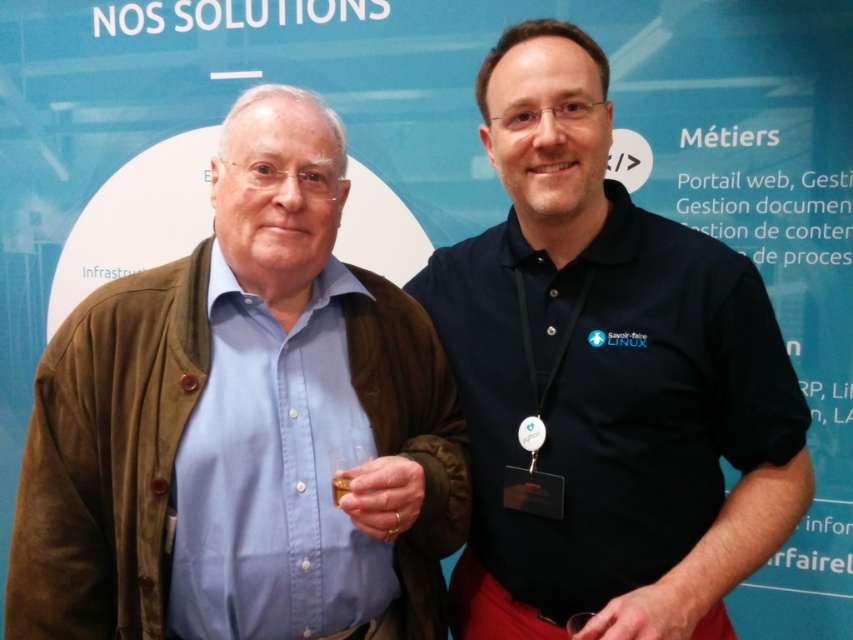
You are an event organizer at the conference and need to place a new decorative item between the dark blue shirt at center and the silver metallic medal at center. Considering their sizes, which object should the new item be placed closer to?

The dark blue shirt at center is bigger than the silver metallic medal at center, so the new decorative item should be placed closer to the silver metallic medal at center to maintain balance.

You are attending a professional event and see two items at the center of the image. Which one is more to the right, the dark blue shirt at center or the silver metallic medal at center?

The dark blue shirt at center is positioned on the right side of the silver metallic medal at center, so the dark blue shirt at center is more to the right.